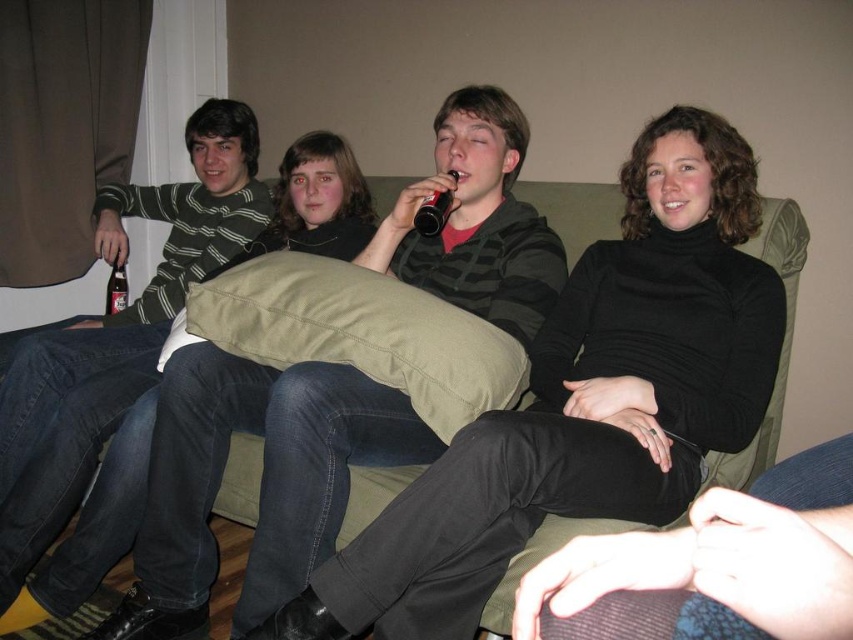
Question: Which of the following is the closest to the observer?

Choices:
 (A) (219, 179)
 (B) (444, 211)
 (C) (357, 260)
 (D) (111, 305)

Answer: (B)

Question: Does striped cotton sweater at left come in front of bottle glass beer at left?

Choices:
 (A) yes
 (B) no

Answer: (A)

Question: In this image, where is matte black jacket at center located relative to black plastic can at center?

Choices:
 (A) below
 (B) above

Answer: (A)

Question: Does matte black jacket at center lie in front of bottle glass beer at left?

Choices:
 (A) yes
 (B) no

Answer: (A)

Question: Which object appears farthest from the camera in this image?

Choices:
 (A) striped cotton sweater at left
 (B) bottle glass beer at left

Answer: (B)

Question: Estimate the real-world distances between objects in this image. Which object is farther from the striped cotton sweater at left?

Choices:
 (A) matte black jacket at center
 (B) black plastic can at center
 (C) bottle glass beer at left

Answer: (B)